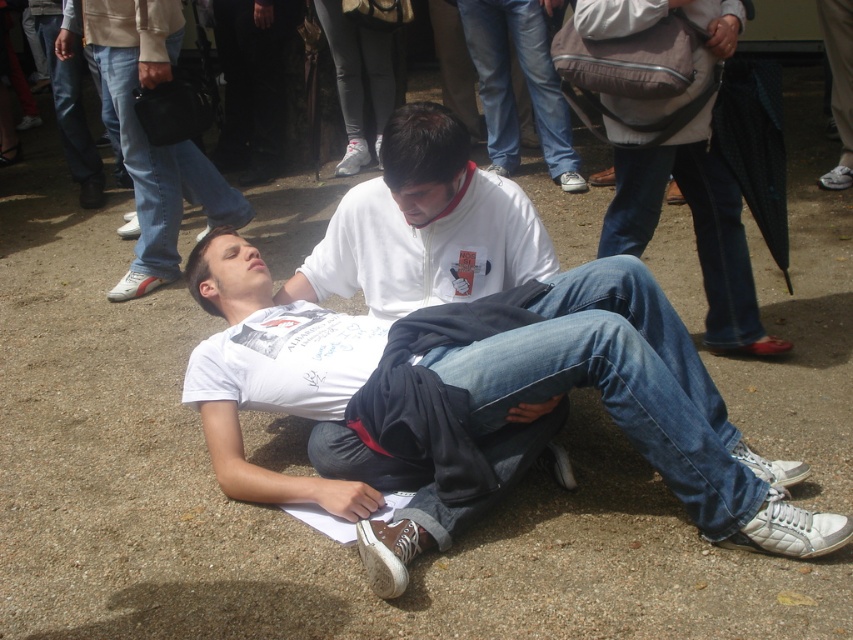
Question: Is white matte t-shirt at center thinner than white matte shirt at center?

Choices:
 (A) yes
 (B) no

Answer: (B)

Question: Can you confirm if matte brown backpack at center is smaller than white matte shirt at center?

Choices:
 (A) no
 (B) yes

Answer: (B)

Question: Which object is farther from the camera taking this photo?

Choices:
 (A) white matte shirt at center
 (B) matte brown backpack at center
 (C) white matte t-shirt at center

Answer: (A)

Question: Which of the following is the closest to the observer?

Choices:
 (A) (469, 445)
 (B) (735, 26)

Answer: (A)

Question: Which point is farther to the camera?

Choices:
 (A) white matte shirt at center
 (B) matte brown backpack at center
 (C) white matte t-shirt at center

Answer: (A)

Question: Can you confirm if matte brown backpack at center is smaller than white matte shirt at center?

Choices:
 (A) yes
 (B) no

Answer: (A)